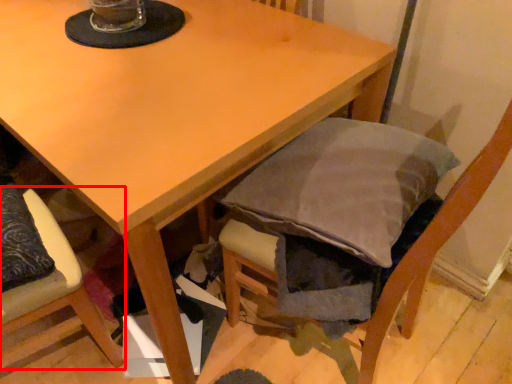
Question: From the image's perspective, what is the correct spatial positioning of chair (annotated by the red box) in reference to chair?

Choices:
 (A) below
 (B) above

Answer: (A)